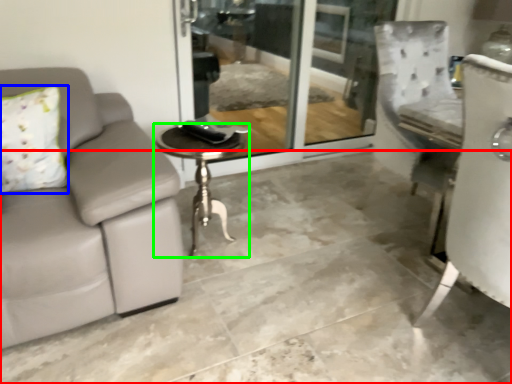
Question: Which object is the farthest from concrete (highlighted by a red box)? Choose among these: pillow (highlighted by a blue box) or table (highlighted by a green box).

Choices:
 (A) pillow
 (B) table

Answer: (A)